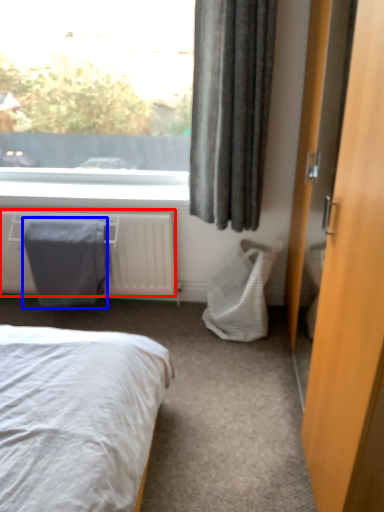
Question: Which point is further to the camera, radiator (highlighted by a red box) or blanket (highlighted by a blue box)?

Choices:
 (A) radiator
 (B) blanket

Answer: (B)